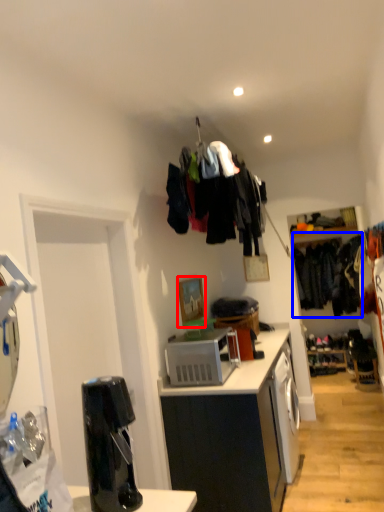
Question: Which point is closer to the camera, picture frame (highlighted by a red box) or clothing (highlighted by a blue box)?

Choices:
 (A) picture frame
 (B) clothing

Answer: (A)